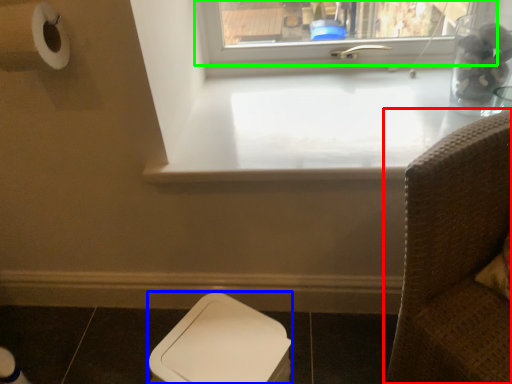
Question: Considering the real-world distances, which object is farthest from furniture (highlighted by a red box)? toilet bowl (highlighted by a blue box) or window (highlighted by a green box)?

Choices:
 (A) toilet bowl
 (B) window

Answer: (B)